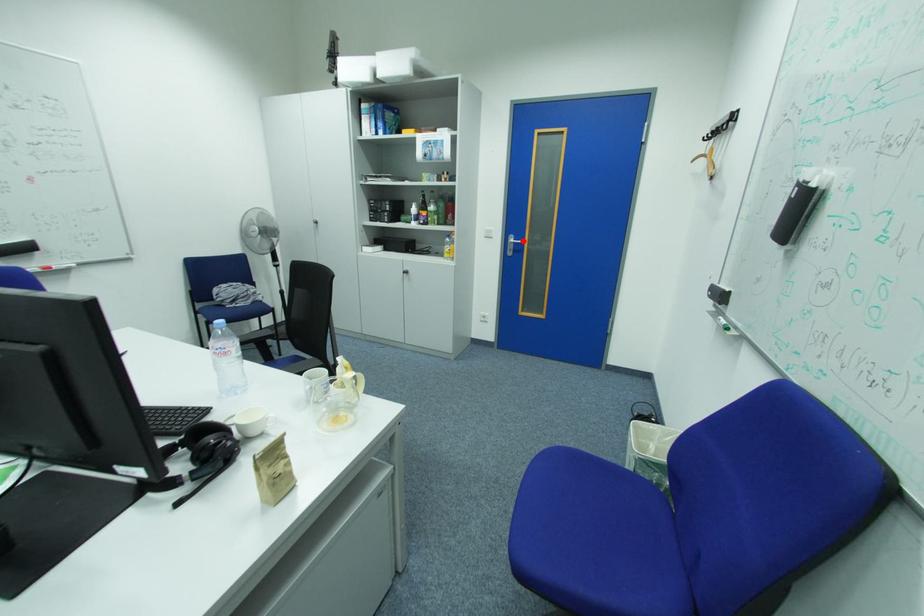
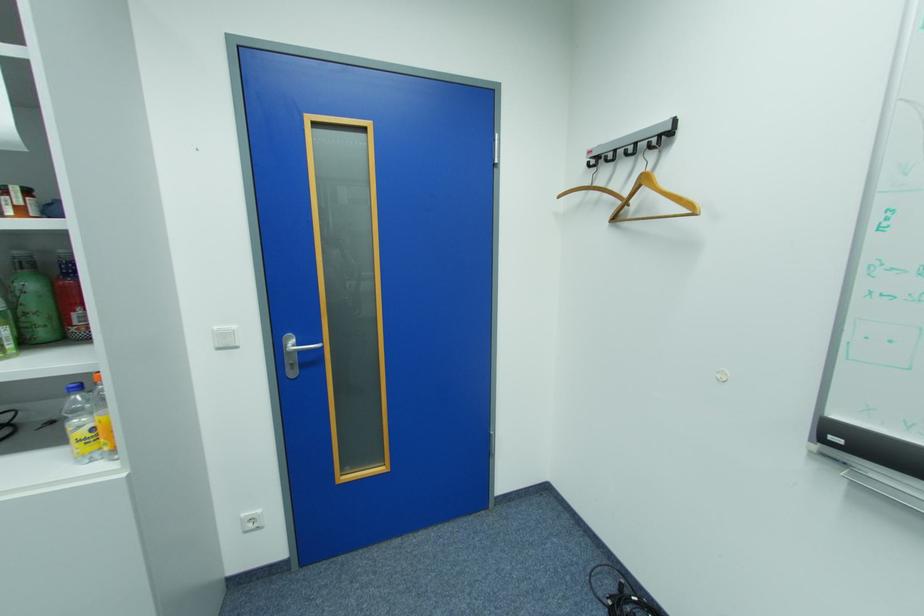
Question: I am providing you with two images of the same scene from different viewpoints. A red point is shown in image1. For the corresponding object point in image2, is it positioned nearer or farther from the camera?

Choices:
 (A) Nearer
 (B) Farther

Answer: (B)